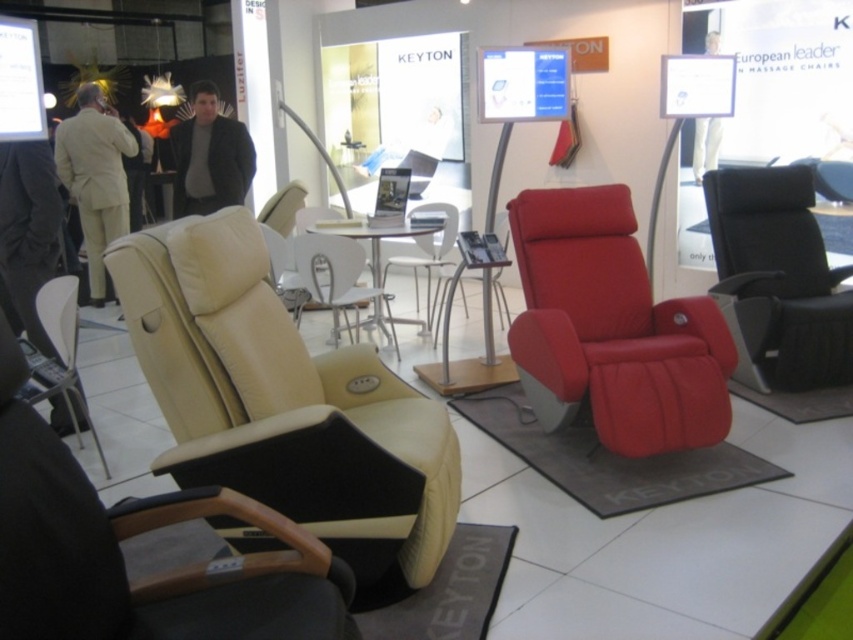
You are a customer in the showroom and want to sit on the beige leather armchair at left. From your current position, which direction should you move to reach it first before the matte red swivel chair at center?

The beige leather armchair at left is located below the matte red swivel chair at center, so you should move downward to reach the beige leather armchair at left first before the matte red swivel chair at center.

Consider the image. You are standing in the showroom and want to locate the beige leather chair at lower left. According to the 2D coordinates provided, what is its position relative to the center of the image?

The beige leather chair at lower left is located at coordinates point 0.555 on the x axis and 0.072 on the y axis, which places it to the right and above the center of the image since the center would be at 0.5 on both axes.